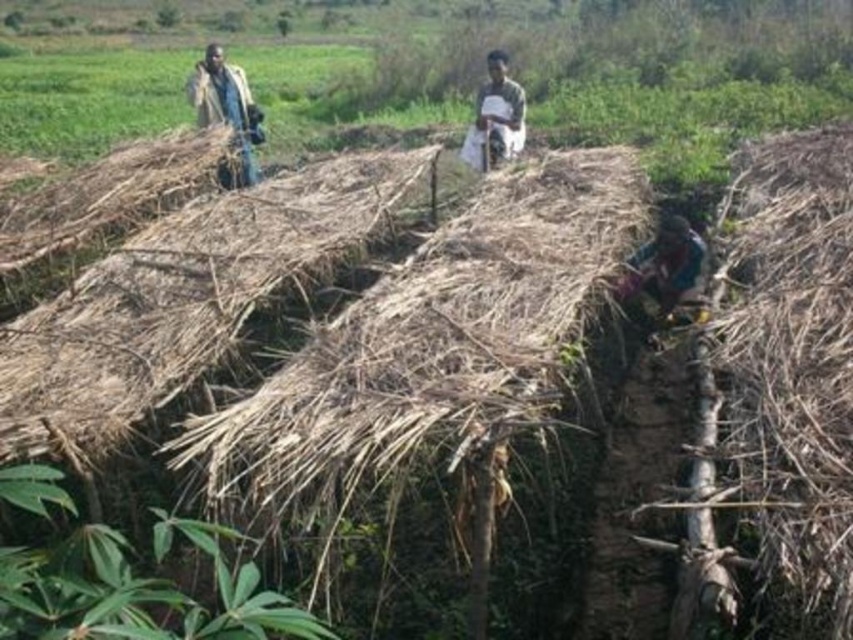
Question: Does multicolored fabric at right appear over light brown fabric at upper left?

Choices:
 (A) yes
 (B) no

Answer: (B)

Question: Which of the following is the farthest from the observer?

Choices:
 (A) (674, 285)
 (B) (479, 93)

Answer: (B)

Question: Which point is closer to the camera taking this photo?

Choices:
 (A) (492, 52)
 (B) (207, 109)

Answer: (B)

Question: Is dry straw at right wider than dark green fabric at center?

Choices:
 (A) no
 (B) yes

Answer: (B)

Question: Which point is farther to the camera?

Choices:
 (A) (770, 602)
 (B) (631, 273)
 (C) (523, 124)

Answer: (C)

Question: Is dry straw at right positioned before multicolored fabric at right?

Choices:
 (A) no
 (B) yes

Answer: (B)